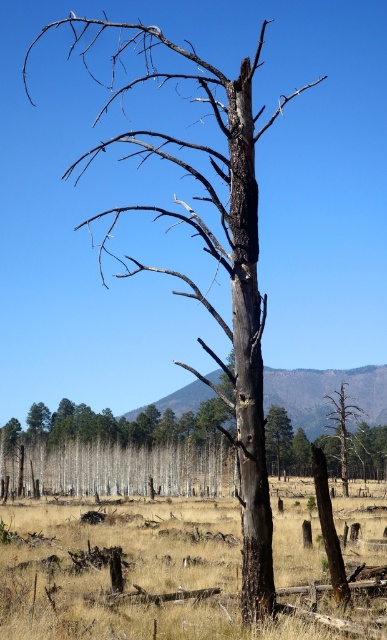
Which of these two, dry grass at center or charred bark tree at center, stands shorter?

With less height is charred bark tree at center.

Looking at this image, is dry grass at center smaller than charred bark tree at center?

Incorrect, dry grass at center is not smaller in size than charred bark tree at center.

Find the location of a particular element. Image resolution: width=387 pixels, height=640 pixels. dry grass at center is located at coordinates click(x=176, y=572).

This screenshot has width=387, height=640. I want to click on dry grass at center, so click(x=176, y=572).

Is dry grass at center shorter than charred wood tree at center?

Yes.

Which of these two, dry grass at center or charred wood tree at center, stands taller?

Standing taller between the two is charred wood tree at center.

Where is `dry grass at center`? The height and width of the screenshot is (640, 387). dry grass at center is located at coordinates (176, 572).

At what (x,y) coordinates should I click in order to perform the action: click on dry grass at center. Please return your answer as a coordinate pair (x, y). This screenshot has height=640, width=387. Looking at the image, I should click on (176, 572).

Find the location of a particular element. Image resolution: width=387 pixels, height=640 pixels. charred wood tree at center is located at coordinates (342, 426).

Which is in front, point (340, 433) or point (287, 413)?

Positioned in front is point (340, 433).

Where is `charred wood tree at center`? charred wood tree at center is located at coordinates (342, 426).